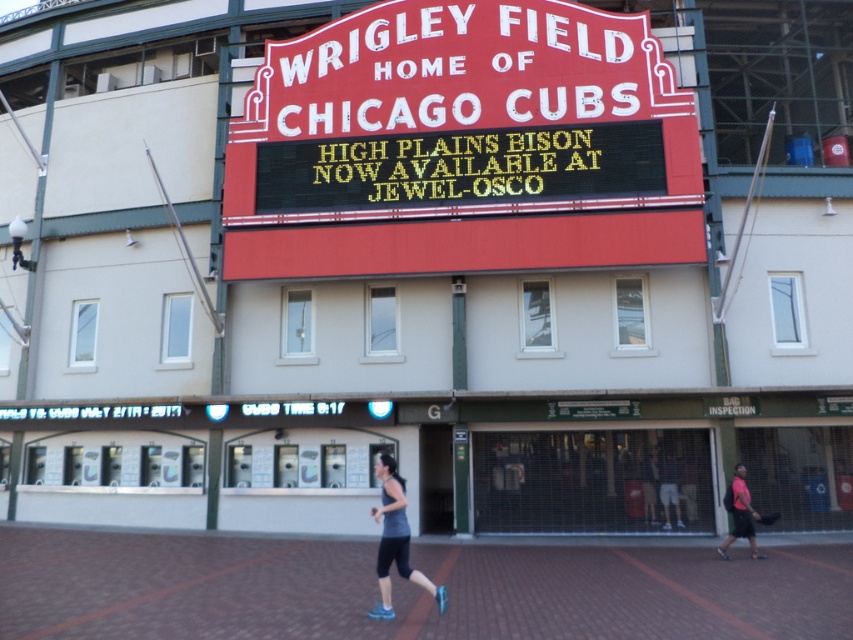
Question: Is black electronic display at center to the right of gray fabric tank top at center from the viewer's perspective?

Choices:
 (A) no
 (B) yes

Answer: (B)

Question: Which of the following is the closest to the observer?

Choices:
 (A) black electronic display at center
 (B) pink fabric shorts at lower right

Answer: (B)

Question: Can you confirm if gray fabric tank top at center is wider than pink fabric shorts at lower right?

Choices:
 (A) no
 (B) yes

Answer: (A)

Question: Among these objects, which one is nearest to the camera?

Choices:
 (A) black electronic display at center
 (B) gray fabric tank top at center

Answer: (B)

Question: Which point appears closest to the camera in this image?

Choices:
 (A) (427, 586)
 (B) (314, 150)
 (C) (749, 499)

Answer: (A)

Question: Can you confirm if black electronic display at center is bigger than pink fabric shorts at lower right?

Choices:
 (A) yes
 (B) no

Answer: (B)